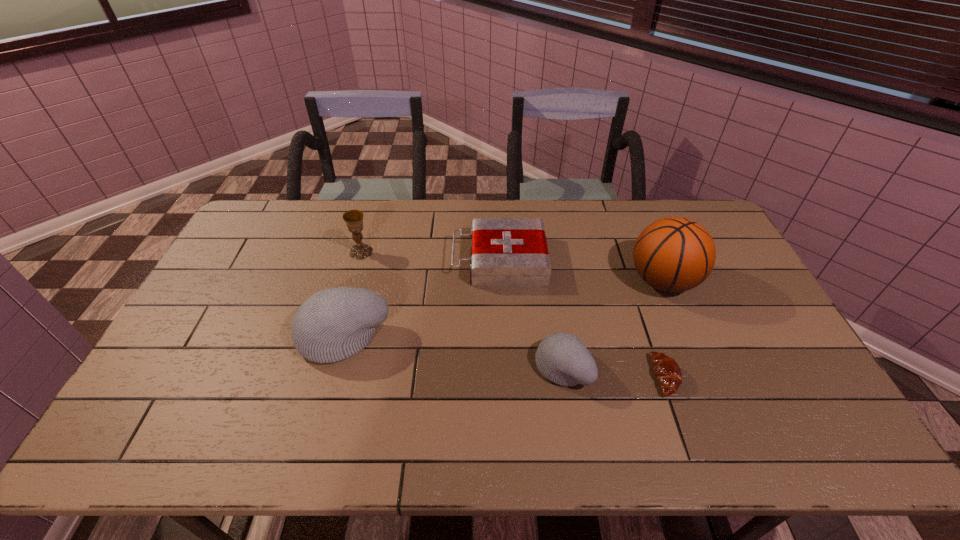
I want to click on vacant region located on the front side of the first-aid kit, so click(378, 260).

This screenshot has width=960, height=540. I want to click on vacant space located on the front side of the first-aid kit, so click(432, 260).

Identify the location of vacant space located 0.090m on the left of the basketball. (599, 280).

Identify the location of vacant space situated 0.260m on the left of the chalice. The image size is (960, 540). (274, 252).

Identify the location of vacant area located 0.280m on the left of the crescent roll. The height and width of the screenshot is (540, 960). (546, 376).

Image resolution: width=960 pixels, height=540 pixels. Identify the location of object that is at the far edge. (506, 252).

You are a GUI agent. You are given a task and a screenshot of the screen. Output one action in this format:
    pyautogui.click(x=<x>, y=<y>)
    Task: Click on the beanie that is at the near edge
    Image resolution: width=960 pixels, height=540 pixels.
    Given the screenshot: What is the action you would take?
    pyautogui.click(x=562, y=358)

What are the coordinates of `crescent roll positioned at the near edge` in the screenshot? It's located at (666, 370).

At what (x,y) coordinates should I click in order to perform the action: click on object at the right edge. Please return your answer as a coordinate pair (x, y). Image resolution: width=960 pixels, height=540 pixels. Looking at the image, I should click on (673, 254).

In the image, there is a desktop. At what (x,y) coordinates should I click in order to perform the action: click on vacant area at the far edge. Please return your answer as a coordinate pair (x, y). Looking at the image, I should click on (326, 232).